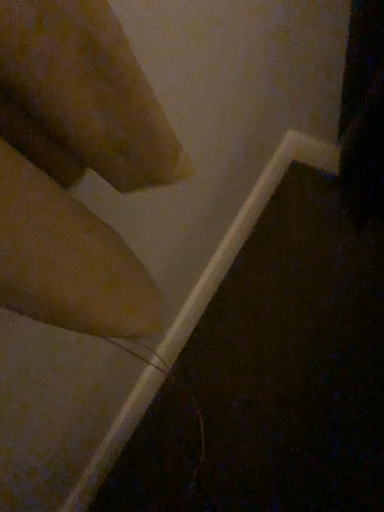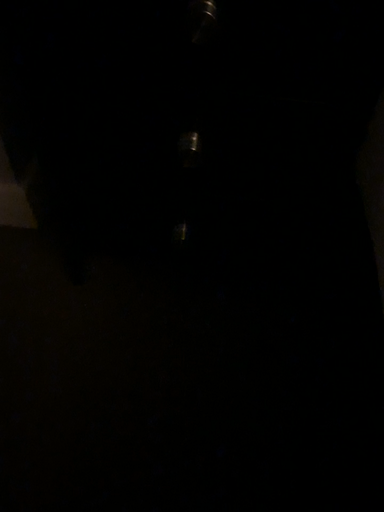
Question: How did the camera likely rotate when shooting the video?

Choices:
 (A) rotated upward
 (B) rotated downward

Answer: (A)